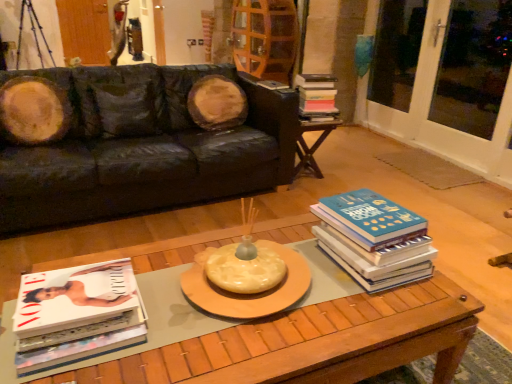
The width and height of the screenshot is (512, 384). Identify the location of wooden side table at right. (312, 145).

Measure the distance between hardcover book at center, which ranks as the third book in bottom-to-top order, and camera.

8.84 feet.

Image resolution: width=512 pixels, height=384 pixels. Describe the element at coordinates (317, 97) in the screenshot. I see `hardcover book at center, the first book from the back` at that location.

In order to click on blue hardcover book at right, the 2th book positioned from the right in this screenshot , I will do `click(374, 239)`.

Can you tell me how much white glass screen door at right, acting as the 2th screen door starting from the top, and blue hardcover book at right, which is counted as the 2th book, starting from the bottom, differ in facing direction?

There is a 90.6-degree angle between the facing directions of white glass screen door at right, acting as the 2th screen door starting from the top, and blue hardcover book at right, which is counted as the 2th book, starting from the bottom.

How far apart are white glass screen door at right, the first screen door when ordered from right to left, and blue hardcover book at right, which is the 2th book in left-to-right order?

The distance of white glass screen door at right, the first screen door when ordered from right to left, from blue hardcover book at right, which is the 2th book in left-to-right order, is 2.24 meters.

You are a GUI agent. You are given a task and a screenshot of the screen. Output one action in this format:
    pyautogui.click(x=<x>, y=<y>)
    Task: Click on the screen door on the right of blue hardcover book at right, which is counted as the 2th book, starting from the top
    
    Given the screenshot: What is the action you would take?
    pyautogui.click(x=439, y=124)

Which of these two, white glass screen door at right, arranged as the 2th screen door when viewed from the left, or blue hardcover book at right, which is counted as the 2th book, starting from the bottom, is wider?

Wider between the two is blue hardcover book at right, which is counted as the 2th book, starting from the bottom.

Is blue hardcover book at right, which is counted as the 2th book, starting from the top, beside wooden coffee table at center?

blue hardcover book at right, which is counted as the 2th book, starting from the top, and wooden coffee table at center are clearly separated.

From the wooden coffee table at center, count 2nd books backward and point to it. Please provide its 2D coordinates.

[(374, 239)]

Is blue hardcover book at right, the 2th book in the front-to-back sequence, bigger than wooden coffee table at center?

Incorrect, blue hardcover book at right, the 2th book in the front-to-back sequence, is not larger than wooden coffee table at center.

Based on the photo, is blue hardcover book at right, which is counted as the 2th book, starting from the bottom, taller or shorter than wooden coffee table at center?

blue hardcover book at right, which is counted as the 2th book, starting from the bottom, is shorter than wooden coffee table at center.

How many degrees apart are the facing directions of wooden side table at right and wooden coffee table at center?

They differ by 4.05 degrees in their facing directions.

Based on their sizes in the image, would you say wooden side table at right is bigger or smaller than wooden coffee table at center?

Clearly, wooden side table at right is smaller in size than wooden coffee table at center.

Looking at this image, based on their positions, is wooden side table at right located to the left or right of wooden coffee table at center?

Based on their positions, wooden side table at right is located to the right of wooden coffee table at center.

Which object is further away from the camera, wooden side table at right or wooden coffee table at center?

wooden side table at right is further away from the camera.

Does blue hardcover book at right, which is the 2th book from back to front, come behind white glossy magazine at lower left, the first book positioned from the bottom?

Yes.

Can you confirm if blue hardcover book at right, the 2th book in the front-to-back sequence, is smaller than white glossy magazine at lower left, marked as the 3th book in a top-to-bottom arrangement?

No.

What's the angular difference between blue hardcover book at right, which is counted as the 2th book, starting from the bottom, and white glossy magazine at lower left, which ranks as the 1th book in left-to-right order,'s facing directions?

There is a 0.00153-degree angle between the facing directions of blue hardcover book at right, which is counted as the 2th book, starting from the bottom, and white glossy magazine at lower left, which ranks as the 1th book in left-to-right order.

Does point (414, 224) appear closer or farther from the camera than point (61, 316)?

Point (414, 224).

From the image's perspective, between white glass screen door at right, the first screen door in the front-to-back sequence, and wooden coffee table at center, which one is located above?

white glass screen door at right, the first screen door in the front-to-back sequence, from the image's perspective.

Is point (397, 134) in front of point (319, 300)?

No.

Based on the photo, is white glass screen door at right, arranged as the 2th screen door when viewed from the left, further to the viewer compared to wooden coffee table at center?

Yes, white glass screen door at right, arranged as the 2th screen door when viewed from the left, is further from the camera.

Would you say wooden coffee table at center is part of white glass screen door at right, the first screen door when ordered from right to left,'s contents?

No, wooden coffee table at center is not inside white glass screen door at right, the first screen door when ordered from right to left.

In the image, is wooden coffee table at center positioned in front of or behind hardcover book at center, which is the first book from top to bottom?

In the image, wooden coffee table at center appears in front of hardcover book at center, which is the first book from top to bottom.

Choose the correct answer: Is wooden coffee table at center inside hardcover book at center, acting as the third book starting from the left, or outside it?

wooden coffee table at center is spatially situated outside hardcover book at center, acting as the third book starting from the left.

From the image's perspective, is wooden coffee table at center located beneath hardcover book at center, acting as the first book starting from the right?

Correct, wooden coffee table at center appears lower than hardcover book at center, acting as the first book starting from the right, in the image.

From a real-world perspective, relative to hardcover book at center, which is the first book from top to bottom, is wooden coffee table at center vertically above or below?

From a real-world perspective, wooden coffee table at center is physically below hardcover book at center, which is the first book from top to bottom.

From a real-world perspective, is hardcover book at center, which is the first book from top to bottom, physically below white glossy magazine at lower left, which ranks as the 1th book in left-to-right order?

Actually, hardcover book at center, which is the first book from top to bottom, is physically above white glossy magazine at lower left, which ranks as the 1th book in left-to-right order, in the real world.

Between hardcover book at center, acting as the first book starting from the right, and white glossy magazine at lower left, which ranks as the 1th book in left-to-right order, which one has smaller size?

white glossy magazine at lower left, which ranks as the 1th book in left-to-right order, is smaller.

From the blue hardcover book at right, which is the 2th book in left-to-right order, count 1st screen doors backward and point to it. Please provide its 2D coordinates.

[(439, 124)]

Which book is the 1st one when counting from the right side of the wooden coffee table at center? Please provide its 2D coordinates.

[(374, 239)]

Based on their spatial positions, is black leather couch at upper left or white glossy magazine at lower left, the first book positioned from the bottom, closer to wooden coffee table at center?

Based on the image, white glossy magazine at lower left, the first book positioned from the bottom, appears to be nearer to wooden coffee table at center.

Which object lies nearer to the anchor point white glossy magazine at lower left, the 3th book from the back, wooden screen door at upper left, which is counted as the 1th screen door, starting from the left, or white glass screen door at right, the first screen door in the front-to-back sequence?

white glass screen door at right, the first screen door in the front-to-back sequence, is positioned closer to the anchor white glossy magazine at lower left, the 3th book from the back.

Based on their spatial positions, is white glass screen door at right, the first screen door when ordered from right to left, or wooden coffee table at center closer to wooden side table at right?

white glass screen door at right, the first screen door when ordered from right to left, is positioned closer to the anchor wooden side table at right.

Looking at the image, which one is located closer to white glass screen door at right, placed as the 2th screen door when sorted from back to front, blue hardcover book at right, which is counted as the 2th book, starting from the bottom, or wooden coffee table at center?

Among the two, blue hardcover book at right, which is counted as the 2th book, starting from the bottom, is located nearer to white glass screen door at right, placed as the 2th screen door when sorted from back to front.

Based on their spatial positions, is wooden screen door at upper left, which is counted as the 1th screen door, starting from the left, or white glossy magazine at lower left, the third book viewed from the right, further from white glass screen door at right, the first screen door when ordered from right to left?

wooden screen door at upper left, which is counted as the 1th screen door, starting from the left.

Based on their spatial positions, is hardcover book at center, which ranks as the third book in bottom-to-top order, or black leather couch at upper left further from wooden side table at right?

black leather couch at upper left.

Which object lies further to the anchor point wooden screen door at upper left, the 1th screen door in the top-to-bottom sequence, white glossy magazine at lower left, the 3th book from the back, or white glass screen door at right, the first screen door in the front-to-back sequence?

white glossy magazine at lower left, the 3th book from the back.

From the image, which object appears to be farther from wooden screen door at upper left, which is the 1th screen door from back to front, hardcover book at center, acting as the third book starting from the left, or white glass screen door at right, placed as the 2th screen door when sorted from back to front?

Based on the image, white glass screen door at right, placed as the 2th screen door when sorted from back to front, appears to be further to wooden screen door at upper left, which is the 1th screen door from back to front.

Where is `table between hardcover book at center, acting as the first book starting from the right, and wooden screen door at upper left, which is the 1th screen door from back to front, from front to back`? table between hardcover book at center, acting as the first book starting from the right, and wooden screen door at upper left, which is the 1th screen door from back to front, from front to back is located at coordinates (312, 145).

Identify the location of table between wooden coffee table at center and wooden screen door at upper left, which is counted as the 1th screen door, starting from the left, in the front-back direction. (312, 145).

Locate an element on the screen. studio couch positioned between blue hardcover book at right, which is the 2th book from back to front, and hardcover book at center, which is the first book from top to bottom, from near to far is located at coordinates point(142,148).

Locate an element on the screen. Image resolution: width=512 pixels, height=384 pixels. book situated between black leather couch at upper left and blue hardcover book at right, which is counted as the 2th book, starting from the bottom, from left to right is located at coordinates (75, 297).